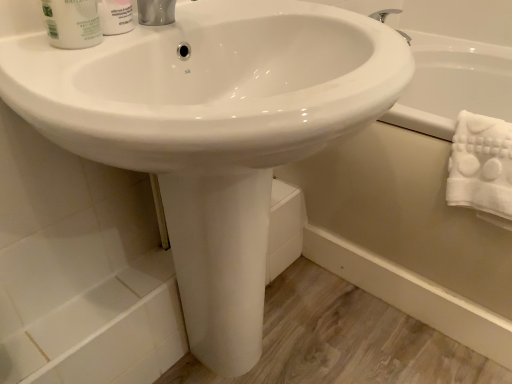
Question: Should I look upward or downward to see white glossy mouthwash at upper left?

Choices:
 (A) up
 (B) down

Answer: (A)

Question: From a real-world perspective, is white glossy bathtub at lower right below white fluffy towel at right?

Choices:
 (A) yes
 (B) no

Answer: (A)

Question: Does white glossy bathtub at lower right appear on the left side of white fluffy towel at right?

Choices:
 (A) yes
 (B) no

Answer: (B)

Question: Can you confirm if white glossy bathtub at lower right is wider than white fluffy towel at right?

Choices:
 (A) no
 (B) yes

Answer: (B)

Question: Is white glossy bathtub at lower right completely or partially outside of white fluffy towel at right?

Choices:
 (A) yes
 (B) no

Answer: (A)

Question: Is white glossy bathtub at lower right at the right side of white fluffy towel at right?

Choices:
 (A) no
 (B) yes

Answer: (B)

Question: Could you tell me if white glossy bathtub at lower right is facing white fluffy towel at right?

Choices:
 (A) no
 (B) yes

Answer: (B)

Question: Considering the relative sizes of white matte shaving cream at upper left and white glossy mouthwash at upper left in the image provided, is white matte shaving cream at upper left shorter than white glossy mouthwash at upper left?

Choices:
 (A) no
 (B) yes

Answer: (A)

Question: Does white matte shaving cream at upper left have a lesser width compared to white glossy mouthwash at upper left?

Choices:
 (A) no
 (B) yes

Answer: (B)

Question: Considering the relative sizes of white matte shaving cream at upper left and white glossy mouthwash at upper left in the image provided, is white matte shaving cream at upper left wider than white glossy mouthwash at upper left?

Choices:
 (A) yes
 (B) no

Answer: (B)

Question: Is white matte shaving cream at upper left looking in the opposite direction of white glossy mouthwash at upper left?

Choices:
 (A) no
 (B) yes

Answer: (A)

Question: From the image's perspective, is white matte shaving cream at upper left on top of white glossy mouthwash at upper left?

Choices:
 (A) no
 (B) yes

Answer: (B)

Question: Considering the relative sizes of white matte shaving cream at upper left and white glossy mouthwash at upper left in the image provided, is white matte shaving cream at upper left bigger than white glossy mouthwash at upper left?

Choices:
 (A) yes
 (B) no

Answer: (B)

Question: Are white fluffy towel at right and white glossy bathtub at lower right making contact?

Choices:
 (A) no
 (B) yes

Answer: (A)